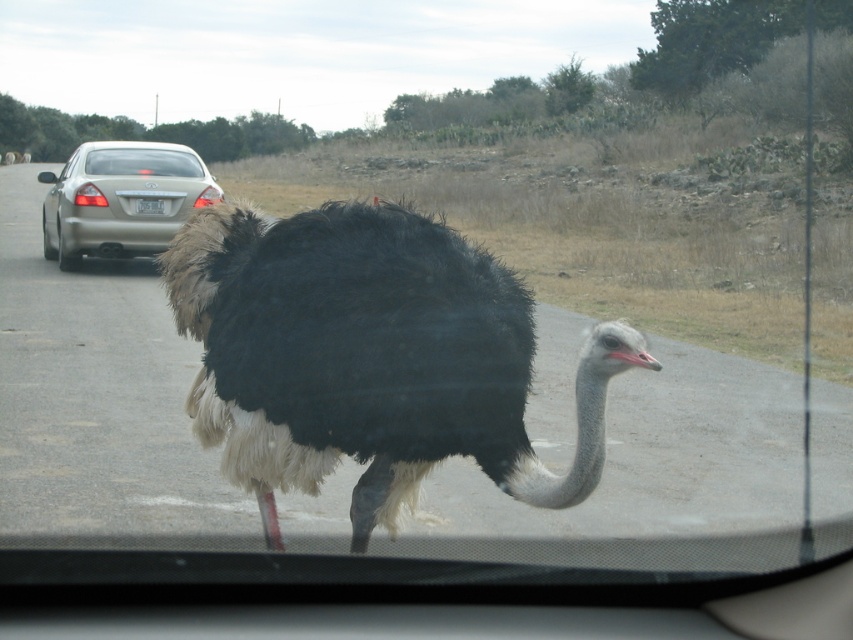
Question: Which point is farther to the camera?

Choices:
 (A) pos(416,269)
 (B) pos(76,200)

Answer: (B)

Question: Which point is farther to the camera?

Choices:
 (A) (216, 280)
 (B) (215, 198)

Answer: (B)

Question: Does black feathered ostrich at center appear on the left side of metallic gold sedan at left?

Choices:
 (A) no
 (B) yes

Answer: (A)

Question: Is black feathered ostrich at center bigger than metallic gold sedan at left?

Choices:
 (A) yes
 (B) no

Answer: (B)

Question: Is black feathered ostrich at center to the left of metallic gold sedan at left from the viewer's perspective?

Choices:
 (A) yes
 (B) no

Answer: (B)